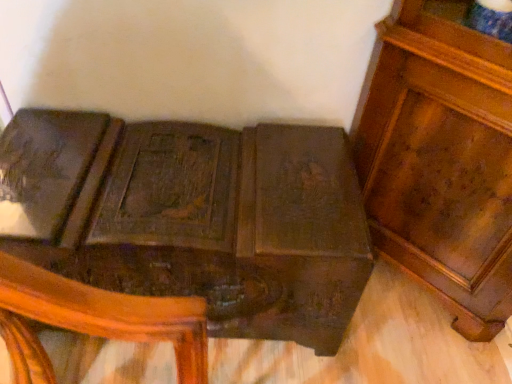
Question: From the image's perspective, is glossy wood cabinet at upper right, the second furniture when ordered from left to right, on top of dark wood carved trunk at center, which is the first furniture from left to right?

Choices:
 (A) yes
 (B) no

Answer: (A)

Question: Can you confirm if glossy wood cabinet at upper right, the second furniture when ordered from left to right, is smaller than dark wood carved trunk at center, which is the first furniture from left to right?

Choices:
 (A) yes
 (B) no

Answer: (A)

Question: From a real-world perspective, is glossy wood cabinet at upper right, which is the 1th furniture from right to left, below dark wood carved trunk at center, which is the first furniture from left to right?

Choices:
 (A) yes
 (B) no

Answer: (B)

Question: Can you confirm if glossy wood cabinet at upper right, which is the 1th furniture from right to left, is shorter than dark wood carved trunk at center, which is the first furniture from left to right?

Choices:
 (A) yes
 (B) no

Answer: (B)

Question: Can you confirm if glossy wood cabinet at upper right, which is the 1th furniture from right to left, is wider than dark wood carved trunk at center, the 2th furniture viewed from the right?

Choices:
 (A) no
 (B) yes

Answer: (A)

Question: Considering the relative sizes of glossy wood cabinet at upper right, which is the 1th furniture from right to left, and dark wood carved trunk at center, the 2th furniture viewed from the right, in the image provided, is glossy wood cabinet at upper right, which is the 1th furniture from right to left, taller than dark wood carved trunk at center, the 2th furniture viewed from the right,?

Choices:
 (A) yes
 (B) no

Answer: (A)

Question: Is dark wood carved trunk at center, which is the first furniture from left to right, bigger than glossy wood cabinet at upper right, which is the 1th furniture from right to left?

Choices:
 (A) no
 (B) yes

Answer: (B)

Question: Is dark wood carved trunk at center, which is the first furniture from left to right, thinner than glossy wood cabinet at upper right, the second furniture when ordered from left to right?

Choices:
 (A) yes
 (B) no

Answer: (B)

Question: Is dark wood carved trunk at center, the 2th furniture viewed from the right, with glossy wood cabinet at upper right, the second furniture when ordered from left to right?

Choices:
 (A) no
 (B) yes

Answer: (A)

Question: Is glossy wood cabinet at upper right, which is the 1th furniture from right to left, a part of dark wood carved trunk at center, which is the first furniture from left to right?

Choices:
 (A) yes
 (B) no

Answer: (B)

Question: Can you confirm if dark wood carved trunk at center, which is the first furniture from left to right, is taller than glossy wood cabinet at upper right, which is the 1th furniture from right to left?

Choices:
 (A) yes
 (B) no

Answer: (B)

Question: Can you confirm if dark wood carved trunk at center, the 2th furniture viewed from the right, is positioned to the left of glossy wood cabinet at upper right, which is the 1th furniture from right to left?

Choices:
 (A) no
 (B) yes

Answer: (B)

Question: In the image, is glossy wood cabinet at upper right, the second furniture when ordered from left to right, on the left side or the right side of dark wood carved trunk at center, which is the first furniture from left to right?

Choices:
 (A) left
 (B) right

Answer: (B)